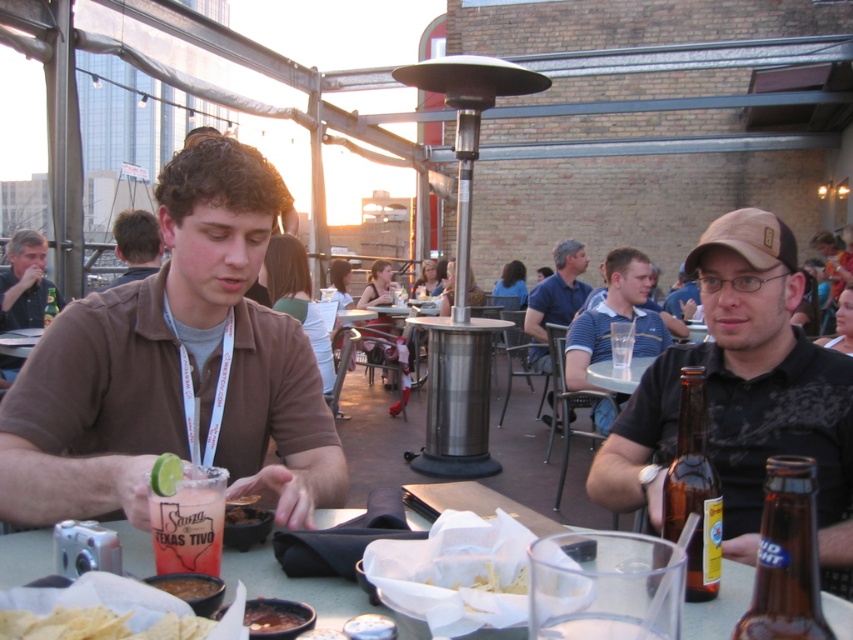
You are a waiter at this restaurant and need to deliver a dessert to the customer seated at the table. The dessert requires placing it between the brown glass beer bottle at lower right and the camera. Considering the space between these two items, do you think the dessert will fit comfortably?

The distance between the brown glass beer bottle at lower right and the camera is 28.30 inches, so the dessert should fit comfortably in that space.

You are standing at the camera position. Which of the two points, point (128,317) or point (700,616), is closer to you?

Point (128,317) is closer to you because it is further to the viewer than point (700,616).

You are standing in front of the table where the person with the camera is sitting. There are two points marked on the table. One is at coordinate point (x=804, y=637) and the other is at point (x=708, y=557). Which point is closer to you?

Point (x=804, y=637) is closer to the viewer than point (x=708, y=557).